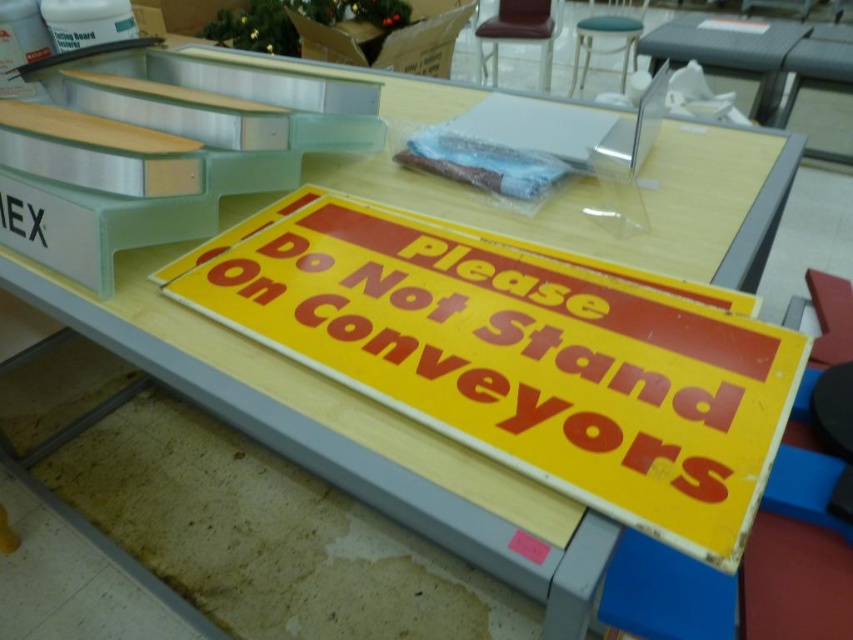
In the scene shown: You are an inspector in the warehouse and need to place a heavy tool on the clear plastic table at upper right and the metallic silver stool at upper center. Which surface can safely hold the tool based on their sizes?

The metallic silver stool at upper center can safely hold the tool because it is larger than the clear plastic table at upper right.

You are a warehouse worker who needs to move a box from the clear plastic table at upper right to the metallic silver stool at upper center. Can you carry it directly without needing to go around any obstacles, given that the space between them is sufficient?

The distance between the clear plastic table at upper right and the metallic silver stool at upper center is 22.51 inches, so you can carry the box directly without needing to go around any obstacles as the space is sufficient.